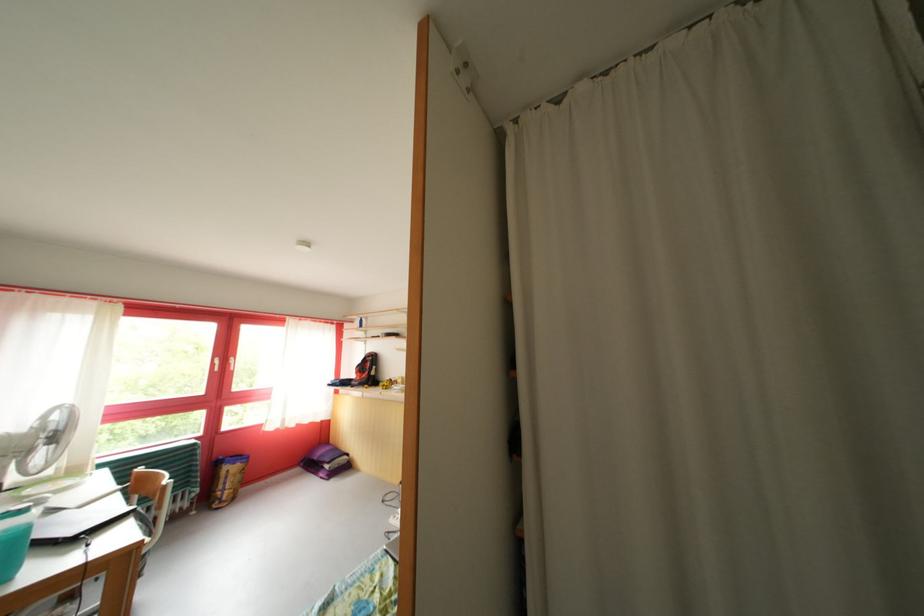
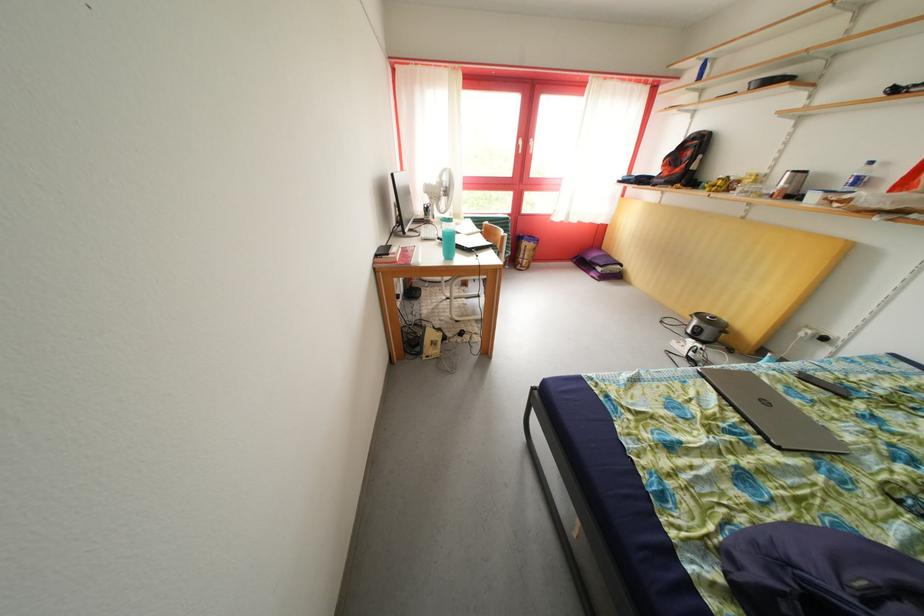
Where in the second image is the point corresponding to (x=371, y=367) from the first image?

(689, 153)